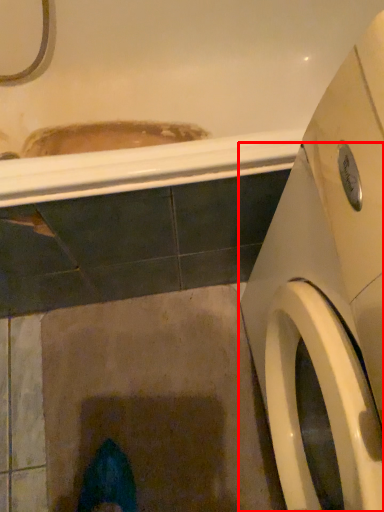
Question: From the image, what is the correct spatial relationship of washing machine (annotated by the red box) in relation to bath?

Choices:
 (A) left
 (B) right

Answer: (B)